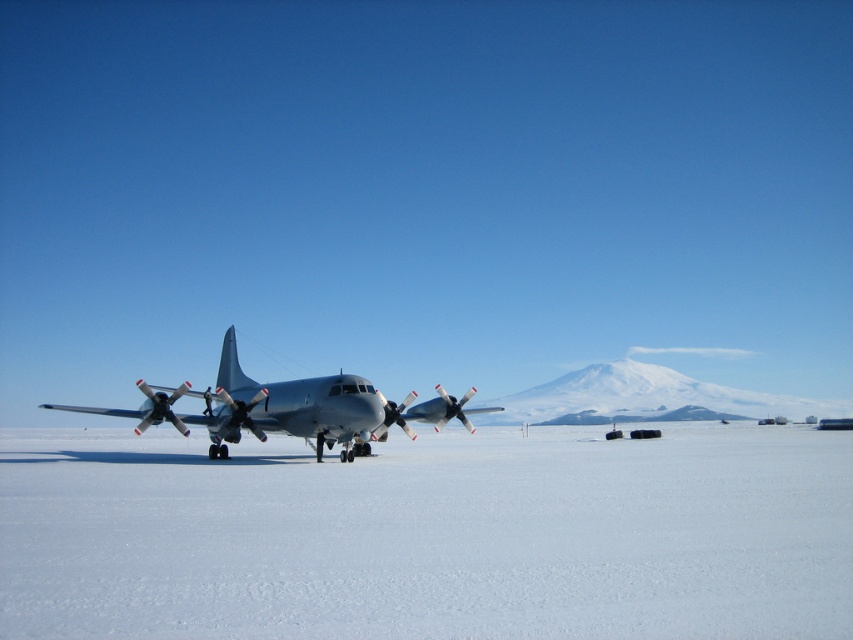
Can you confirm if white smooth snow at center is thinner than metallic gray airplane at center?

In fact, white smooth snow at center might be wider than metallic gray airplane at center.

Describe the element at coordinates (428, 536) in the screenshot. This screenshot has height=640, width=853. I see `white smooth snow at center` at that location.

Image resolution: width=853 pixels, height=640 pixels. Find the location of `white smooth snow at center`. white smooth snow at center is located at coordinates (428, 536).